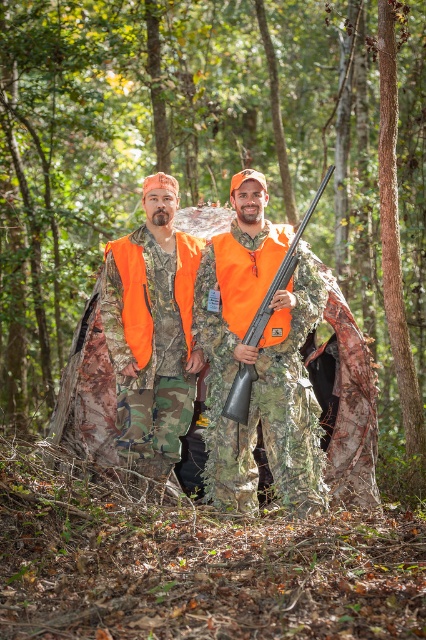
Which of these two, camouflage fabric hunting gear at center or camouflage fabric jacket at center, stands taller?

Standing taller between the two is camouflage fabric jacket at center.

Can you confirm if camouflage fabric hunting gear at center is shorter than camouflage fabric jacket at center?

Yes, camouflage fabric hunting gear at center is shorter than camouflage fabric jacket at center.

The image size is (426, 640). Describe the element at coordinates (123, 364) in the screenshot. I see `camouflage fabric hunting gear at center` at that location.

Locate an element on the screen. The height and width of the screenshot is (640, 426). camouflage fabric hunting gear at center is located at coordinates tap(123, 364).

Is camouflage fabric jacket at center above matte orange shotgun at center?

No.

The image size is (426, 640). Describe the element at coordinates (152, 332) in the screenshot. I see `camouflage fabric jacket at center` at that location.

Between point (135, 372) and point (253, 376), which one is positioned behind?

Positioned behind is point (135, 372).

Where is `camouflage fabric jacket at center`? camouflage fabric jacket at center is located at coordinates (152, 332).

Is the position of camouflage fabric hunting gear at center more distant than that of matte orange shotgun at center?

Yes, camouflage fabric hunting gear at center is further from the viewer.

Which is below, camouflage fabric hunting gear at center or matte orange shotgun at center?

camouflage fabric hunting gear at center is lower down.

Who is more forward, (x=94, y=410) or (x=273, y=296)?

Point (x=273, y=296)

Find the location of a particular element. This screenshot has width=426, height=640. camouflage fabric hunting gear at center is located at coordinates (123, 364).